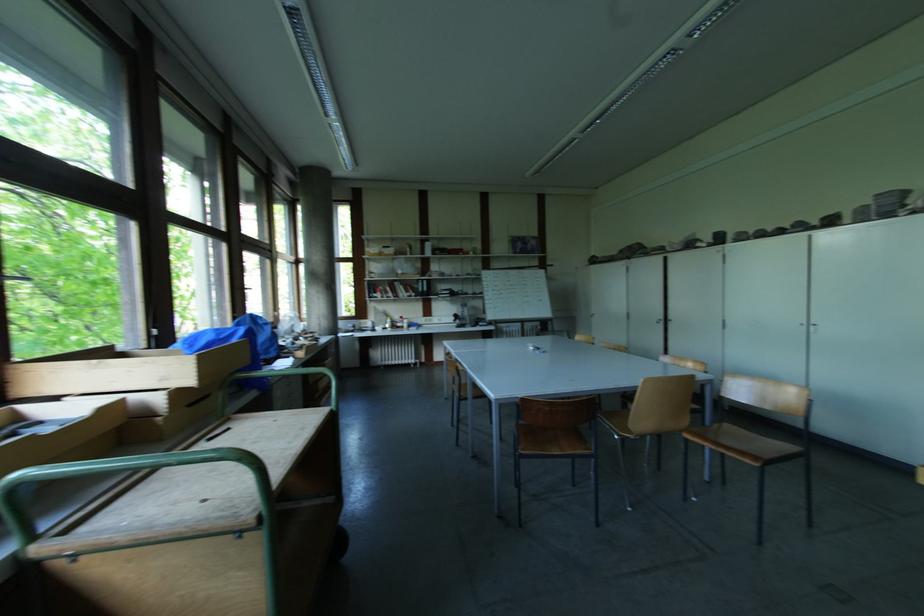
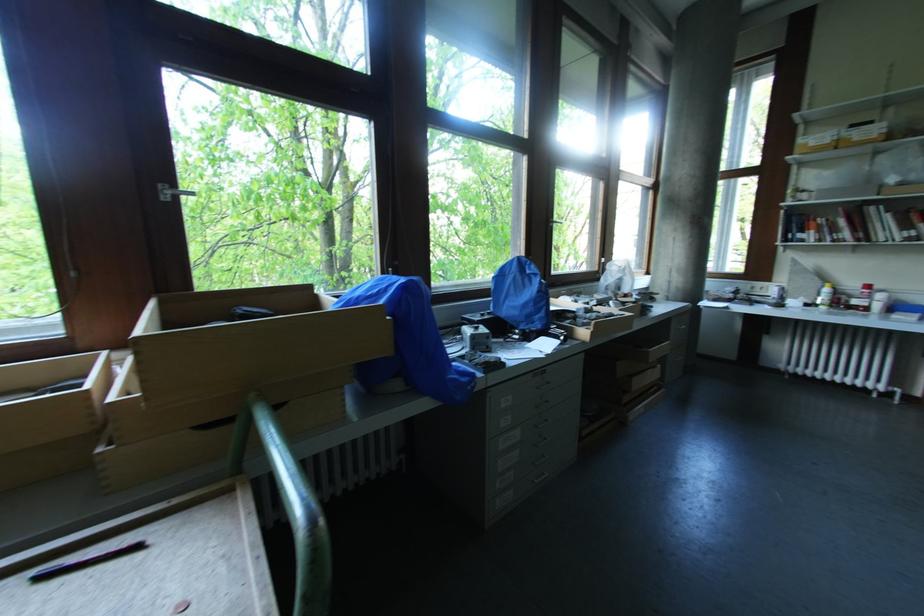
Find the pixel in the second image that matches (232,431) in the first image.

(140, 549)